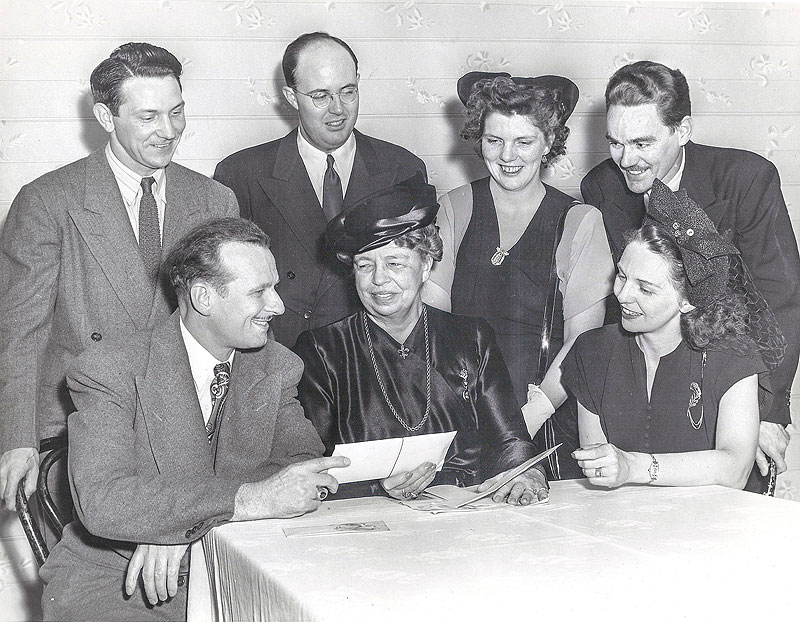
Where is `table cloth`? table cloth is located at coordinates (666, 571).